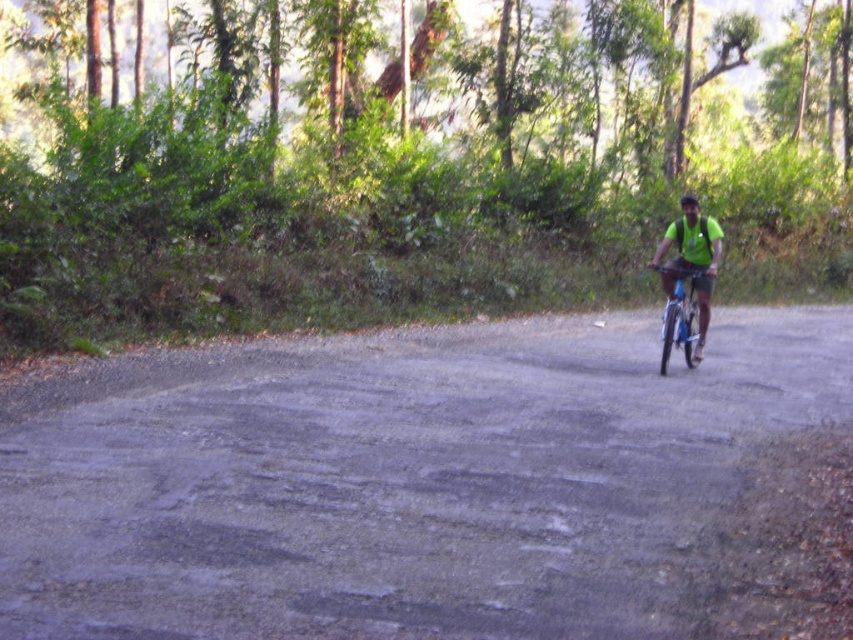
You are a cyclist riding on the gray asphalt road at center. You notice a green matte shirt at center in your path. Can you safely avoid it without leaving the road?

The gray asphalt road at center is bigger than the green matte shirt at center, so there is enough space to maneuver around the green matte shirt at center while staying on the road.

In the scene shown: You are a photographer trying to capture the cyclist in the scene. You notice the green matte shirt at center and the black matte helmet at upper center. Which object should you focus on if you want to photograph the smaller one?

The green matte shirt at center has a smaller size compared to the black matte helmet at upper center, so you should focus on the green matte shirt at center.

You are navigating a bicycle and need to stay on the gray asphalt road at center. Based on the scene description, where should you position yourself to stay on the road?

The gray asphalt road at center is located at point (x=424, y=484), so you should position yourself around those coordinates to stay on the road.